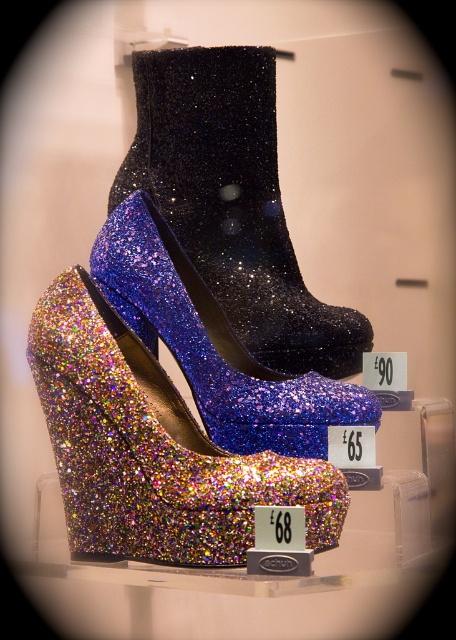
Can you confirm if glittery multicolor platform shoe at center is positioned above glittery blue platform shoe at center?

No, glittery multicolor platform shoe at center is not above glittery blue platform shoe at center.

Between glittery multicolor platform shoe at center and glittery blue platform shoe at center, which one appears on the left side from the viewer's perspective?

Positioned to the left is glittery multicolor platform shoe at center.

Locate an element on the screen. glittery multicolor platform shoe at center is located at coordinates (151, 449).

Based on the photo, is glittery multicolor platform shoe at center shorter than glittery black boot at center?

Yes, glittery multicolor platform shoe at center is shorter than glittery black boot at center.

Who is more forward, (x=77, y=369) or (x=337, y=337)?

Positioned in front is point (x=77, y=369).

This screenshot has width=456, height=640. Describe the element at coordinates (151, 449) in the screenshot. I see `glittery multicolor platform shoe at center` at that location.

At what (x,y) coordinates should I click in order to perform the action: click on glittery multicolor platform shoe at center. Please return your answer as a coordinate pair (x, y). The image size is (456, 640). Looking at the image, I should click on (151, 449).

Does glittery black boot at center have a smaller size compared to glittery blue platform shoe at center?

Yes.

Is glittery black boot at center to the right of glittery blue platform shoe at center from the viewer's perspective?

Indeed, glittery black boot at center is positioned on the right side of glittery blue platform shoe at center.

The height and width of the screenshot is (640, 456). Find the location of `glittery black boot at center`. glittery black boot at center is located at coordinates (233, 202).